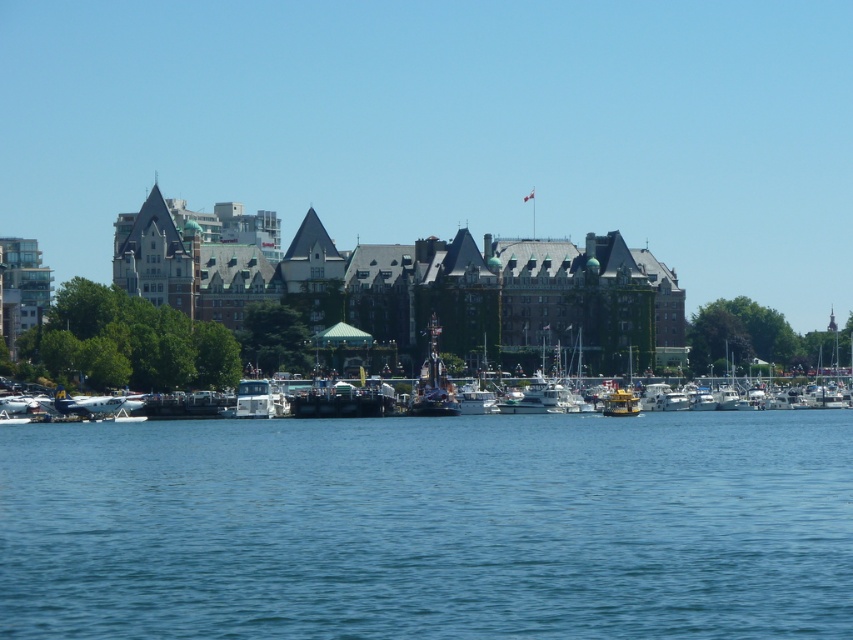
Question: Is blue water at center positioned in front of white glossy boat at center?

Choices:
 (A) yes
 (B) no

Answer: (A)

Question: Can you confirm if white glossy boat at center is smaller than shiny silver statue at center?

Choices:
 (A) yes
 (B) no

Answer: (B)

Question: Is blue water at center to the left of shiny silver statue at center from the viewer's perspective?

Choices:
 (A) yes
 (B) no

Answer: (A)

Question: Which object is positioned closest to the shiny silver statue at center?

Choices:
 (A) white glossy boat at center
 (B) blue water at center

Answer: (A)

Question: Among these points, which one is nearest to the camera?

Choices:
 (A) (422, 372)
 (B) (117, 496)
 (C) (805, 339)

Answer: (B)

Question: Among these points, which one is farthest from the camera?

Choices:
 (A) (424, 384)
 (B) (573, 508)

Answer: (A)